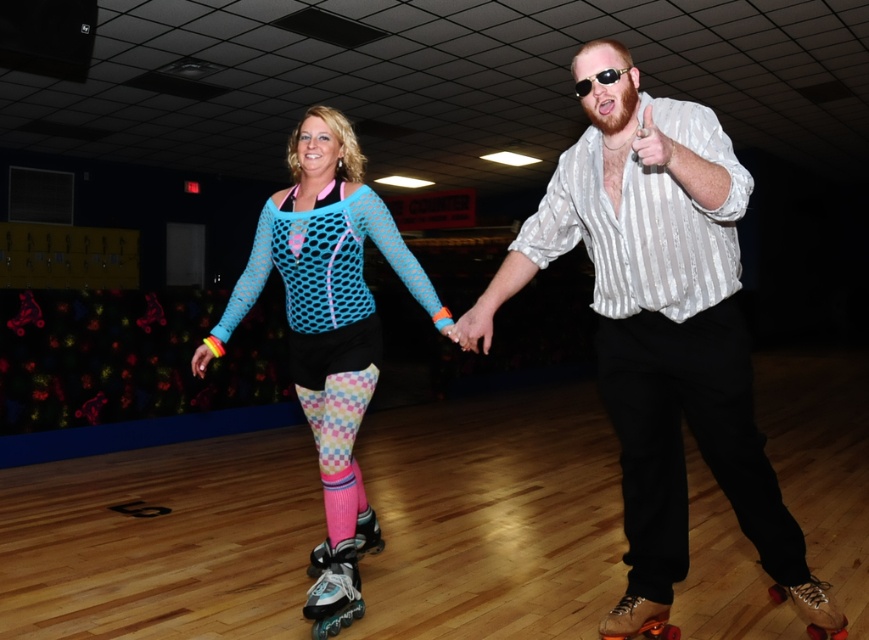
Can you confirm if shiny silver roller skates at center is taller than brown leather roller skates at lower center?

Yes.

Does shiny silver roller skates at center have a smaller size compared to brown leather roller skates at lower center?

No.

Locate an element on the screen. shiny silver roller skates at center is located at coordinates (333, 588).

The width and height of the screenshot is (869, 640). Describe the element at coordinates (657, 312) in the screenshot. I see `silver striped shirt at center` at that location.

Between silver striped shirt at center and pink mesh roller skates at center, which one has less height?

Standing shorter between the two is pink mesh roller skates at center.

This screenshot has width=869, height=640. In order to click on silver striped shirt at center in this screenshot , I will do point(657,312).

Is neon blue mesh top at center to the right of pink mesh roller skates at center from the viewer's perspective?

Incorrect, neon blue mesh top at center is not on the right side of pink mesh roller skates at center.

Does neon blue mesh top at center have a smaller size compared to pink mesh roller skates at center?

No, neon blue mesh top at center is not smaller than pink mesh roller skates at center.

Which is in front, point (302, 337) or point (316, 545)?

Point (302, 337) is more forward.

In order to click on neon blue mesh top at center in this screenshot , I will do `click(327, 296)`.